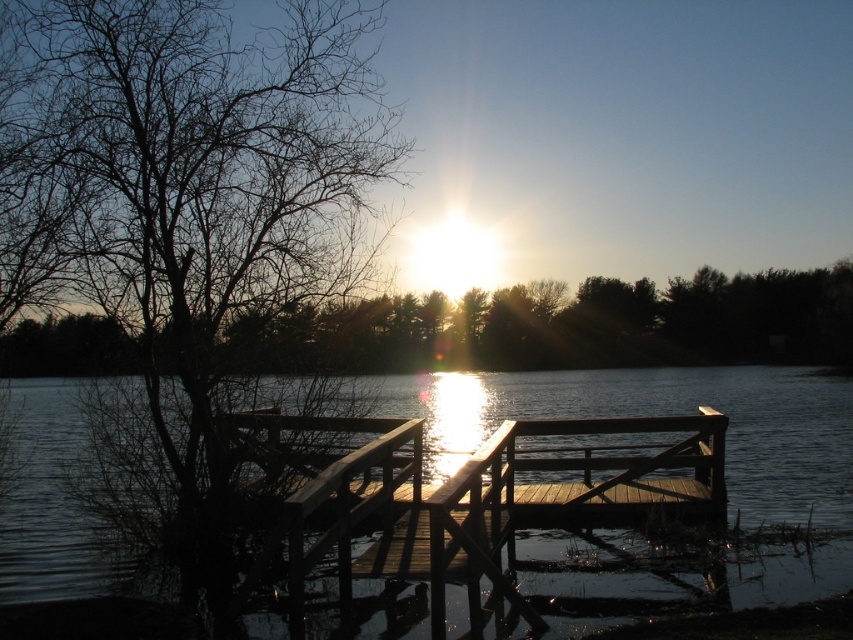
Question: Is brown wood tree at upper left to the right of wooden dock at center from the viewer's perspective?

Choices:
 (A) yes
 (B) no

Answer: (A)

Question: Is the position of dark reflective water at center more distant than that of wooden dock at center?

Choices:
 (A) yes
 (B) no

Answer: (A)

Question: Estimate the real-world distances between objects in this image. Which object is closer to the wooden dock at center?

Choices:
 (A) brown wood tree at upper left
 (B) bare branches at left
 (C) dark reflective water at center

Answer: (C)

Question: Observing the image, what is the correct spatial positioning of bare branches at left in reference to brown wood tree at upper left?

Choices:
 (A) right
 (B) left

Answer: (B)

Question: Among these points, which one is farthest from the camera?

Choices:
 (A) (585, 428)
 (B) (624, 356)
 (C) (473, 385)
 (D) (154, 184)

Answer: (B)

Question: Estimate the real-world distances between objects in this image. Which object is closer to the wooden dock at center?

Choices:
 (A) brown wood tree at upper left
 (B) dark reflective water at center
 (C) bare branches at left

Answer: (B)